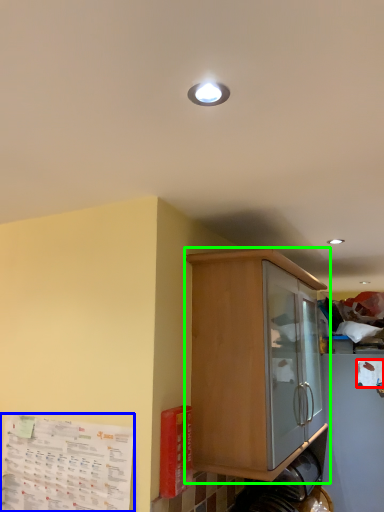
Question: Which is farther away from paper (highlighted by a red box)? paper (highlighted by a blue box) or cabinetry (highlighted by a green box)?

Choices:
 (A) paper
 (B) cabinetry

Answer: (A)